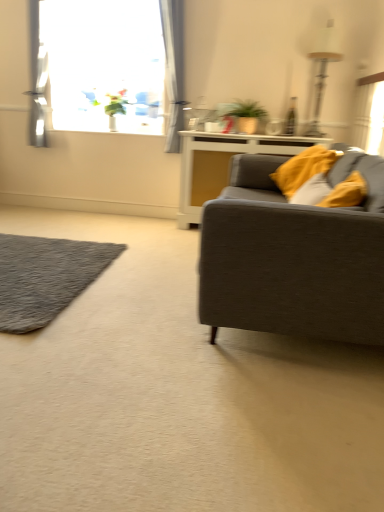
Image resolution: width=384 pixels, height=512 pixels. What do you see at coordinates (222, 164) in the screenshot?
I see `matte white cabinet at center` at bounding box center [222, 164].

What is the approximate width of transparent glass window at upper left?

11.32 inches.

The height and width of the screenshot is (512, 384). I want to click on light gray sheer curtain at upper left, so click(174, 67).

Where is `matte white cabinet at center`? The height and width of the screenshot is (512, 384). matte white cabinet at center is located at coordinates (222, 164).

Based on the photo, from a real-world perspective, between transparent glass window at upper left and gray shaggy rug at lower left, who is vertically lower?

From a 3D spatial view, gray shaggy rug at lower left is below.

Is transparent glass window at upper left positioned with its back to gray shaggy rug at lower left?

No, transparent glass window at upper left is not facing the opposite direction of gray shaggy rug at lower left.

Looking at this image, from the image's perspective, which is above, transparent glass window at upper left or gray shaggy rug at lower left?

transparent glass window at upper left is shown above in the image.

Is textured gray couch at right aimed at light gray sheer curtain at upper left?

No, textured gray couch at right is not aimed at light gray sheer curtain at upper left.

Can you see textured gray couch at right touching light gray sheer curtain at upper left?

textured gray couch at right and light gray sheer curtain at upper left are clearly separated.

From a real-world perspective, relative to light gray sheer curtain at upper left, is textured gray couch at right vertically above or below?

From a real-world perspective, textured gray couch at right is physically below light gray sheer curtain at upper left.

Is transparent glass window at upper left not close to textured gray couch at right?

Absolutely, transparent glass window at upper left is distant from textured gray couch at right.

In the image, is transparent glass window at upper left positioned in front of or behind textured gray couch at right?

In the image, transparent glass window at upper left appears behind textured gray couch at right.

Is transparent glass window at upper left taller or shorter than textured gray couch at right?

transparent glass window at upper left is taller than textured gray couch at right.

Can we say transparent glass window at upper left lies outside textured gray couch at right?

transparent glass window at upper left lies outside textured gray couch at right's area.

From the image's perspective, between textured gray couch at right and gray shaggy rug at lower left, who is located below?

gray shaggy rug at lower left, from the image's perspective.

Can you confirm if textured gray couch at right is taller than gray shaggy rug at lower left?

Yes.

Does textured gray couch at right turn towards gray shaggy rug at lower left?

Yes, textured gray couch at right faces towards gray shaggy rug at lower left.

How many degrees apart are the facing directions of soft yellow pillow at right and textured gray couch at right?

10.1 degrees.

Between soft yellow pillow at right and textured gray couch at right, which one has smaller width?

soft yellow pillow at right is thinner.

You are a GUI agent. You are given a task and a screenshot of the screen. Output one action in this format:
    pyautogui.click(x=<x>, y=<y>)
    Task: Click on the studio couch located below the soft yellow pillow at right (from the image's perspective)
    The image size is (384, 512).
    Given the screenshot: What is the action you would take?
    pyautogui.click(x=294, y=256)

In terms of height, does matte white cabinet at center look taller or shorter compared to soft yellow pillow at right?

Considering their sizes, matte white cabinet at center has more height than soft yellow pillow at right.

Would you consider matte white cabinet at center to be distant from soft yellow pillow at right?

No, matte white cabinet at center is not far away from soft yellow pillow at right.

Is matte white cabinet at center positioned with its back to soft yellow pillow at right?

That's not correct — matte white cabinet at center is not looking away from soft yellow pillow at right.

Could light gray sheer curtain at upper left be considered to be inside gray shaggy rug at lower left?

No, gray shaggy rug at lower left does not contain light gray sheer curtain at upper left.

What's the angular difference between gray shaggy rug at lower left and light gray sheer curtain at upper left's facing directions?

The angle between the facing direction of gray shaggy rug at lower left and the facing direction of light gray sheer curtain at upper left is 1.17 degrees.

Is gray shaggy rug at lower left not close to light gray sheer curtain at upper left?

gray shaggy rug at lower left is far away from light gray sheer curtain at upper left.

From the image's perspective, which one is positioned lower, gray shaggy rug at lower left or light gray sheer curtain at upper left?

From the image's view, gray shaggy rug at lower left is below.

Locate an element on the screen. window behind the gray shaggy rug at lower left is located at coordinates (109, 64).

This screenshot has height=512, width=384. Find the location of `studio couch below the light gray sheer curtain at upper left (from the image's perspective)`. studio couch below the light gray sheer curtain at upper left (from the image's perspective) is located at coordinates (294, 256).

Which object lies nearer to the anchor point transparent glass window at upper left, soft yellow pillow at right or matte white cabinet at center?

matte white cabinet at center lies closer to transparent glass window at upper left than the other object.

Based on their spatial positions, is transparent glass window at upper left or gray shaggy rug at lower left closer to light gray sheer curtain at upper left?

Among the two, transparent glass window at upper left is located nearer to light gray sheer curtain at upper left.

Considering their positions, is light gray sheer curtain at upper left positioned closer to transparent glass window at upper left than textured gray couch at right?

Based on the image, light gray sheer curtain at upper left appears to be nearer to transparent glass window at upper left.

Based on their spatial positions, is light gray sheer curtain at upper left or textured gray couch at right further from soft yellow pillow at right?

light gray sheer curtain at upper left is positioned further to the anchor soft yellow pillow at right.

Estimate the real-world distances between objects in this image. Which object is further from light gray sheer curtain at upper left, textured gray couch at right or gray shaggy rug at lower left?

textured gray couch at right lies further to light gray sheer curtain at upper left than the other object.

Based on their spatial positions, is matte white cabinet at center or transparent glass window at upper left closer to textured gray couch at right?

Among the two, matte white cabinet at center is located nearer to textured gray couch at right.

Based on their spatial positions, is transparent glass window at upper left or soft yellow pillow at right further from textured gray couch at right?

transparent glass window at upper left is further to textured gray couch at right.

Looking at the image, which one is located closer to soft yellow pillow at right, textured gray couch at right or light gray sheer curtain at upper left?

Among the two, textured gray couch at right is located nearer to soft yellow pillow at right.

The image size is (384, 512). I want to click on curtain between transparent glass window at upper left and gray shaggy rug at lower left in the up-down direction, so click(174, 67).

Find the location of a particular element. This screenshot has width=384, height=512. pillow between textured gray couch at right and light gray sheer curtain at upper left along the z-axis is located at coordinates (303, 168).

Identify the location of pillow between transparent glass window at upper left and gray shaggy rug at lower left from top to bottom. (303, 168).

Identify the location of curtain between transparent glass window at upper left and matte white cabinet at center from left to right. (174, 67).